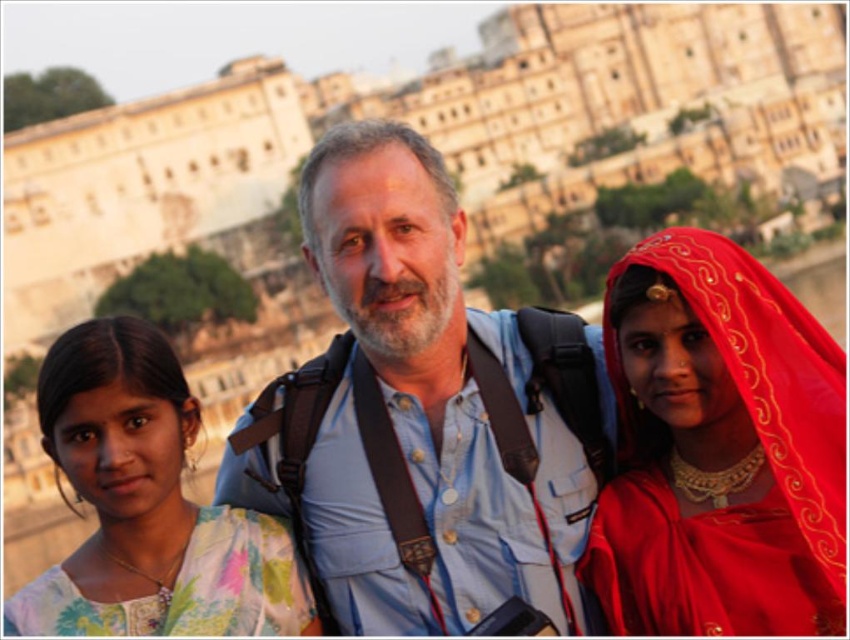
Question: Which point is farther to the camera?

Choices:
 (A) (418, 208)
 (B) (290, 602)

Answer: (A)

Question: Does blue denim shirt at center appear on the left side of floral fabric dress at left?

Choices:
 (A) yes
 (B) no

Answer: (B)

Question: Is blue denim shirt at center positioned at the back of floral fabric dress at left?

Choices:
 (A) yes
 (B) no

Answer: (A)

Question: Is blue denim shirt at center to the right of matte red sari at center from the viewer's perspective?

Choices:
 (A) yes
 (B) no

Answer: (B)

Question: Which object is positioned farthest from the blue denim shirt at center?

Choices:
 (A) floral fabric dress at left
 (B) matte red sari at center

Answer: (A)

Question: Which object is the farthest from the blue denim shirt at center?

Choices:
 (A) floral fabric dress at left
 (B) matte red sari at center

Answer: (A)